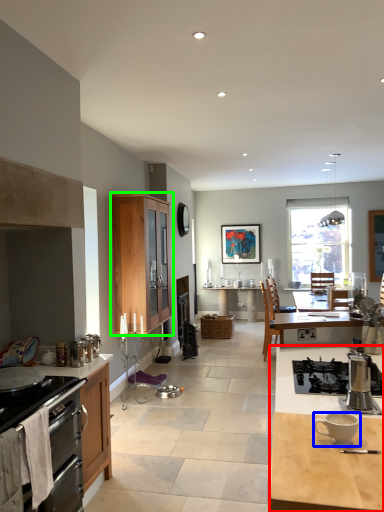
Question: Which is farther away from desk (highlighted by a red box)? coffee cup (highlighted by a blue box) or cabinetry (highlighted by a green box)?

Choices:
 (A) coffee cup
 (B) cabinetry

Answer: (B)